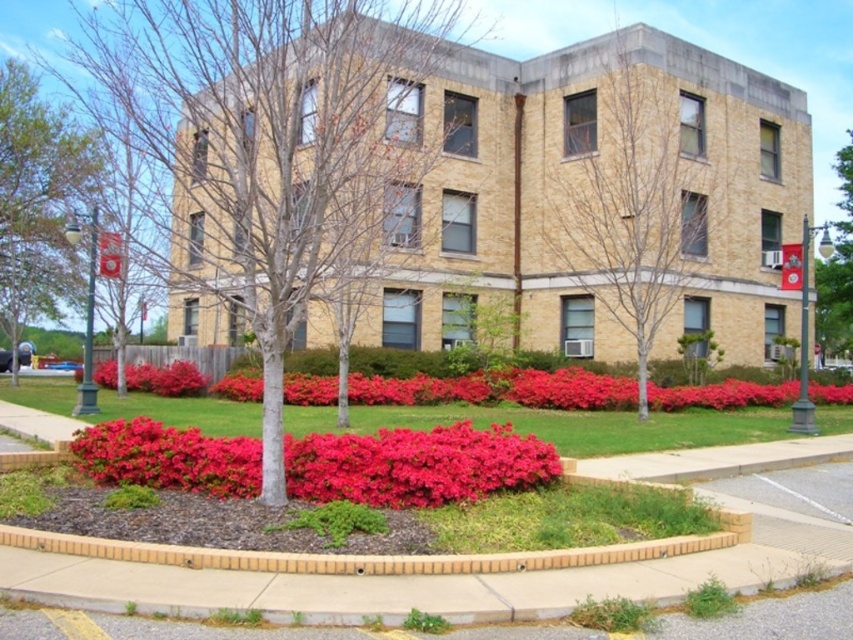
Question: Which point is farther to the camera?

Choices:
 (A) (593, 564)
 (B) (96, 36)
 (C) (621, 128)
 (D) (744, 396)

Answer: (B)

Question: Which object is closer to the camera taking this photo?

Choices:
 (A) green leafy tree at right
 (B) glossy red shrub at center
 (C) green leafy tree at left
 (D) brick at lower center

Answer: (D)

Question: In this image, where is smooth bark tree at center located relative to brick at lower center?

Choices:
 (A) right
 (B) left

Answer: (B)

Question: Which point is farther to the camera?

Choices:
 (A) (325, 390)
 (B) (241, 486)
 (C) (614, 65)

Answer: (C)

Question: In this image, where is smooth bark tree at center located relative to brick at lower center?

Choices:
 (A) right
 (B) left

Answer: (B)

Question: Considering the relative positions of green leafy tree at left and vibrant red petals at center in the image provided, where is green leafy tree at left located with respect to vibrant red petals at center?

Choices:
 (A) above
 (B) below

Answer: (A)